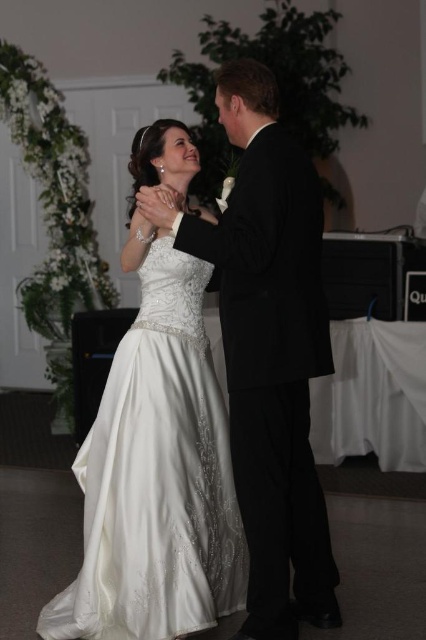
The scene shows a couple dancing at a wedding reception. The man is wearing a black tuxedo and the woman is wearing a white wedding gown. There is a point marked at coordinates (x=155, y=472). What object is located at this point?

The point at coordinates (x=155, y=472) marks the location of the satin dress at center.

Based on the photo, you are a photographer at the wedding reception. You want to capture a closeup shot of the couple without cropping any part of their outfits. Given that the camera frame can only accommodate the width of the shiny black suit at center, will the satin dress at center fit entirely within the frame?

The satin dress at center has a larger width than the shiny black suit at center. Since the camera frame can only accommodate the width of the shiny black suit at center, the satin dress at center will not fit entirely within the frame.